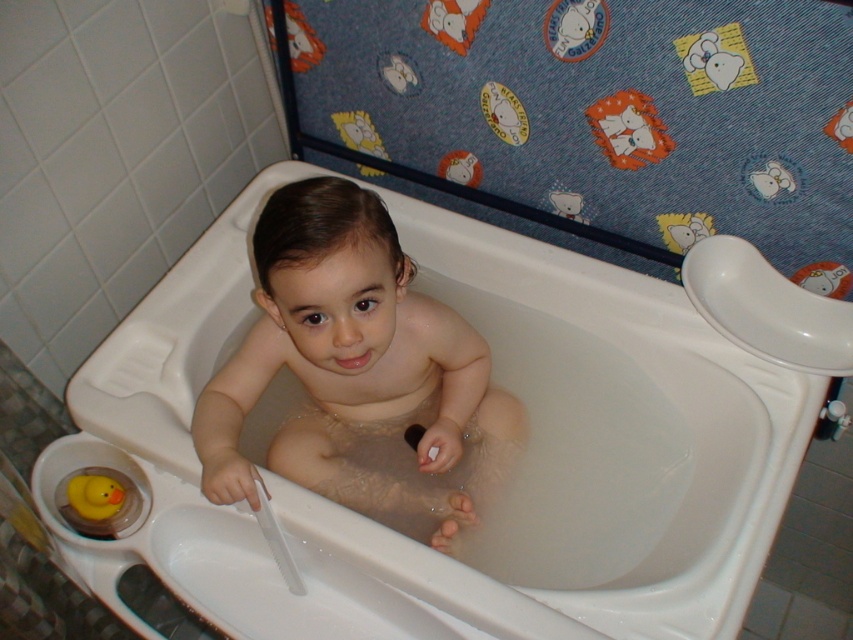
In the scene shown: Does white plastic bathtub at center have a lesser height compared to rubber duck at lower left?

No.

Locate an element on the screen. white plastic bathtub at center is located at coordinates (518, 477).

Between point (683, 314) and point (112, 480), which one is positioned behind?

Positioned behind is point (683, 314).

Image resolution: width=853 pixels, height=640 pixels. What are the coordinates of `white plastic bathtub at center` in the screenshot? It's located at [x=518, y=477].

Does smooth skin baby at center appear on the right side of rubber duck at lower left?

Indeed, smooth skin baby at center is positioned on the right side of rubber duck at lower left.

Which is behind, point (428, 490) or point (97, 509)?

Point (428, 490)

Does point (500, 412) lie in front of point (73, 484)?

That is False.

What are the coordinates of `smooth skin baby at center` in the screenshot? It's located at (357, 372).

Is the position of white plastic bathtub at center less distant than that of smooth skin baby at center?

That is False.

Can you confirm if white plastic bathtub at center is taller than smooth skin baby at center?

Indeed, white plastic bathtub at center has a greater height compared to smooth skin baby at center.

Locate an element on the screen. This screenshot has width=853, height=640. white plastic bathtub at center is located at coordinates (518, 477).